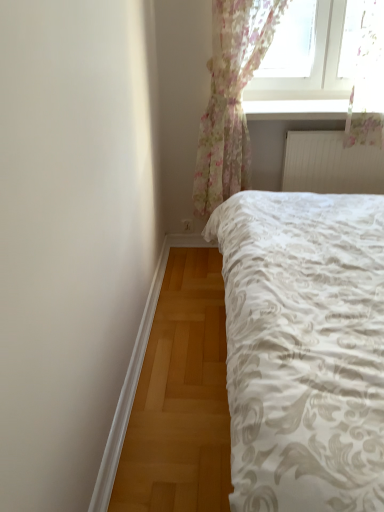
Question: From the image's perspective, is white textured radiator at upper right located above white textured bed at center?

Choices:
 (A) yes
 (B) no

Answer: (A)

Question: Is the surface of white textured radiator at upper right in direct contact with white textured bed at center?

Choices:
 (A) no
 (B) yes

Answer: (A)

Question: Can you confirm if white textured radiator at upper right is thinner than white textured bed at center?

Choices:
 (A) no
 (B) yes

Answer: (B)

Question: Considering the relative sizes of white textured radiator at upper right and white textured bed at center in the image provided, is white textured radiator at upper right shorter than white textured bed at center?

Choices:
 (A) yes
 (B) no

Answer: (A)

Question: Are white textured radiator at upper right and white textured bed at center far apart?

Choices:
 (A) no
 (B) yes

Answer: (A)

Question: Does white textured radiator at upper right have a greater width compared to white textured bed at center?

Choices:
 (A) no
 (B) yes

Answer: (A)

Question: Considering the relative positions of white textured bed at center and white textured radiator at upper right in the image provided, is white textured bed at center to the left of white textured radiator at upper right from the viewer's perspective?

Choices:
 (A) no
 (B) yes

Answer: (B)

Question: Would you say white textured bed at center is outside white textured radiator at upper right?

Choices:
 (A) no
 (B) yes

Answer: (B)

Question: From the image's perspective, does white textured bed at center appear higher than white textured radiator at upper right?

Choices:
 (A) no
 (B) yes

Answer: (A)

Question: From the image's perspective, is white textured bed at center beneath white textured radiator at upper right?

Choices:
 (A) yes
 (B) no

Answer: (A)

Question: Considering the relative sizes of white textured bed at center and white textured radiator at upper right in the image provided, is white textured bed at center smaller than white textured radiator at upper right?

Choices:
 (A) no
 (B) yes

Answer: (A)

Question: Could you tell me if white textured bed at center is turned towards white textured radiator at upper right?

Choices:
 (A) yes
 (B) no

Answer: (B)

Question: Considering the relative sizes of white textured bed at center and floral sheer curtain at upper right in the image provided, is white textured bed at center bigger than floral sheer curtain at upper right?

Choices:
 (A) yes
 (B) no

Answer: (A)